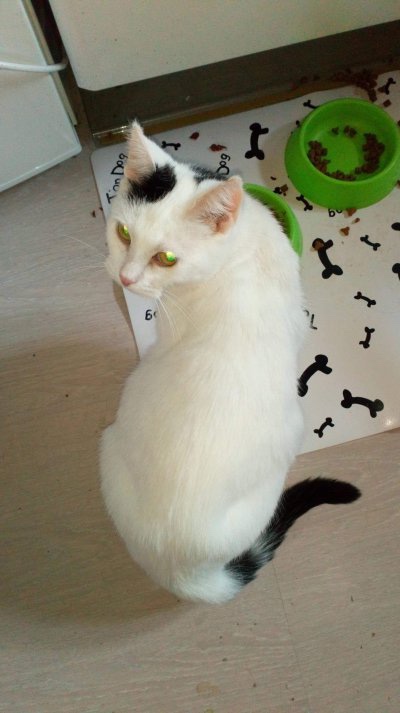
The height and width of the screenshot is (713, 400). What are the coordinates of `bowl` in the screenshot? It's located at (352, 185).